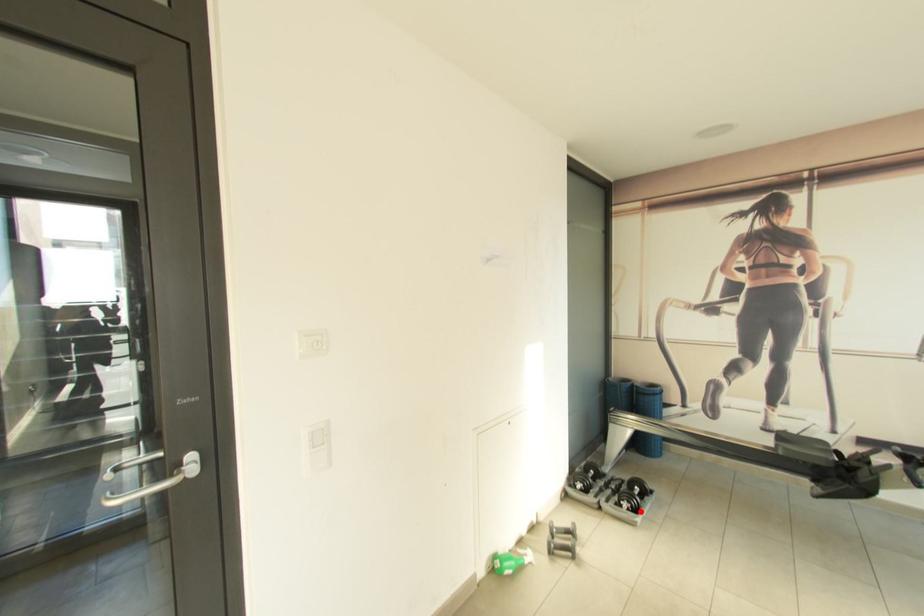
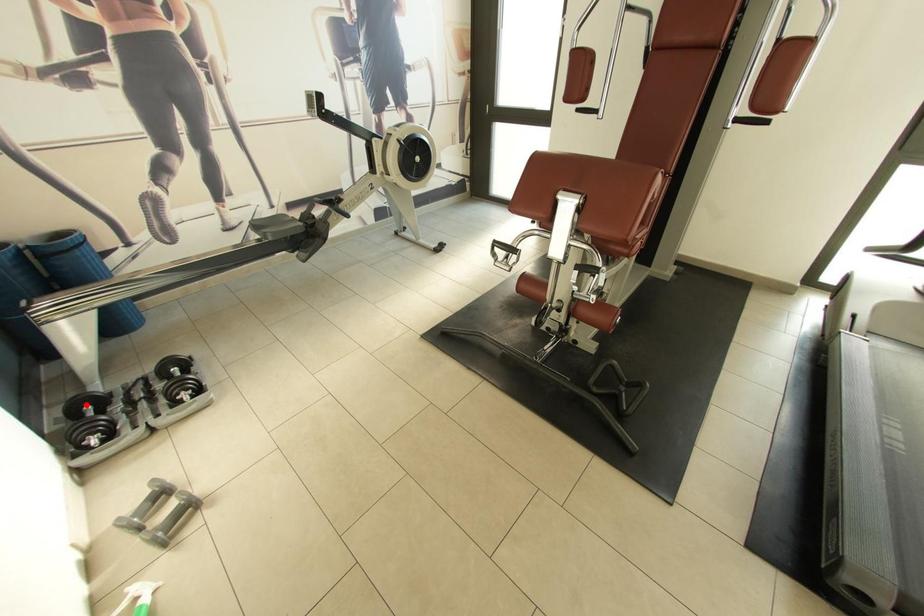
I am providing you with two images of the same scene from different viewpoints. A red point is marked on the first image and another point is marked on the second image. Does the point marked in image1 correspond to the same location as the one in image2?

No